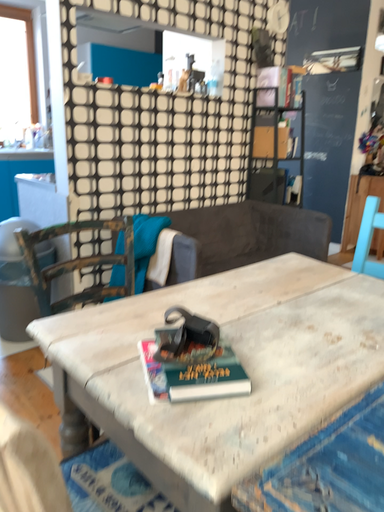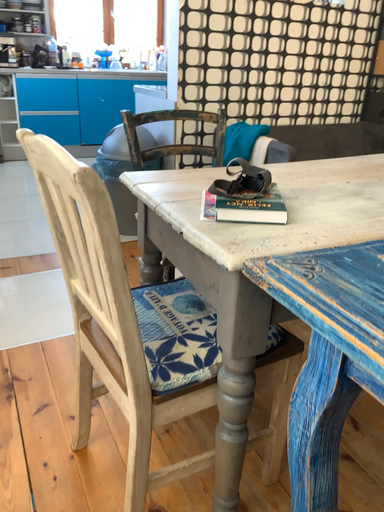
Question: How did the camera likely rotate when shooting the video?

Choices:
 (A) rotated upward
 (B) rotated downward

Answer: (B)